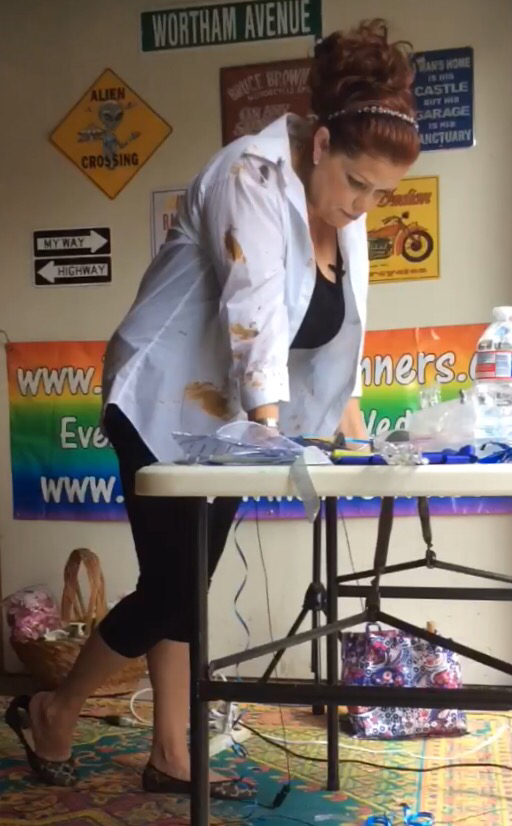
Image resolution: width=512 pixels, height=826 pixels. What are the coordinates of `folding table` in the screenshot? It's located at (346, 489), (455, 486).